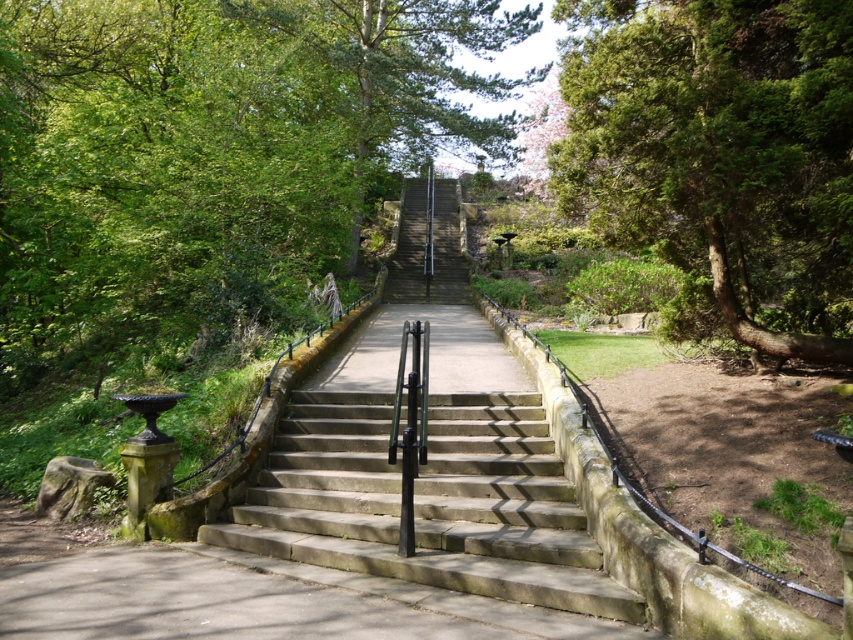
You are standing at the bottom of the stone steps and want to take a photo of both point [358,3] and point [384,396]. Which point should you focus on first to ensure both are in the frame?

You should focus on point [358,3] first because it is closer to the camera than point [384,396], ensuring both points are within the frame.